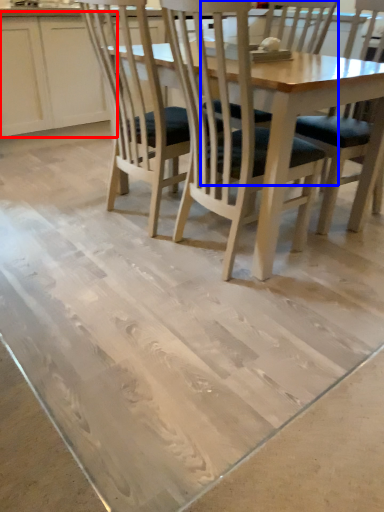
Question: Which of the following is the farthest to the observer, cabinetry (highlighted by a red box) or chair (highlighted by a blue box)?

Choices:
 (A) cabinetry
 (B) chair

Answer: (A)